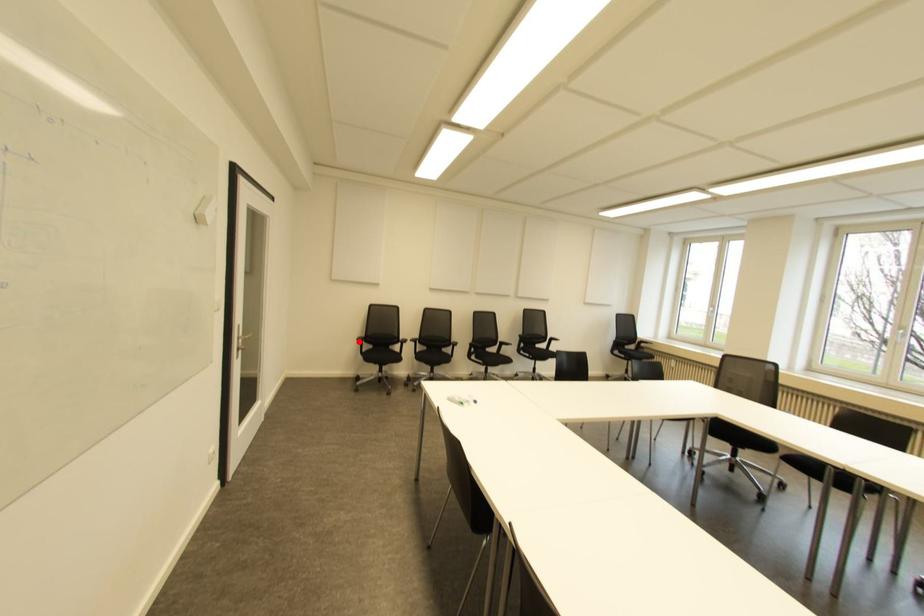
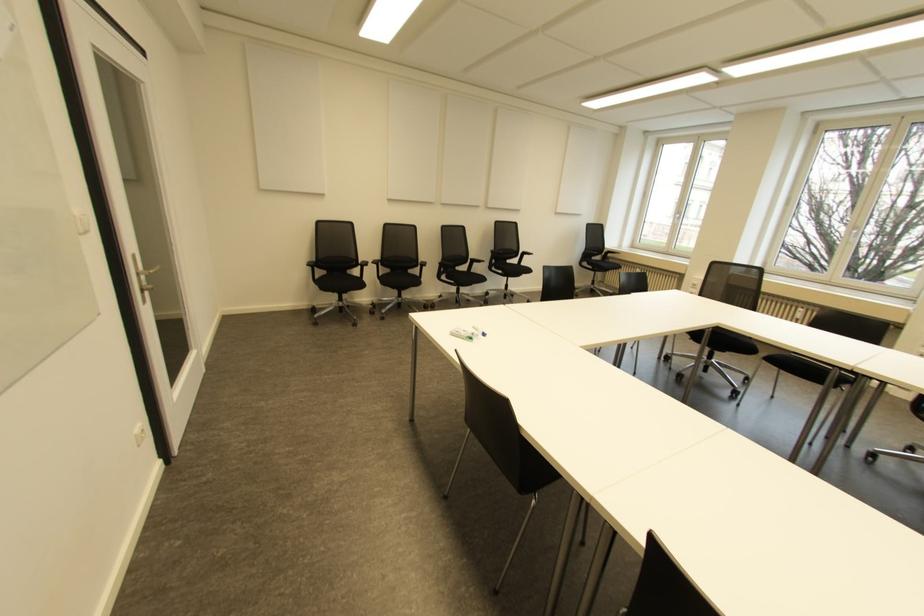
Where in the second image is the point corresponding to the highlighted location from the first image?

(310, 268)